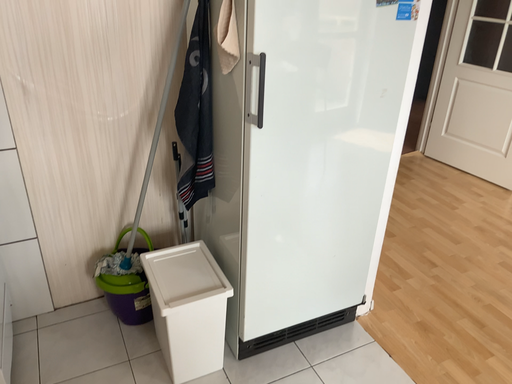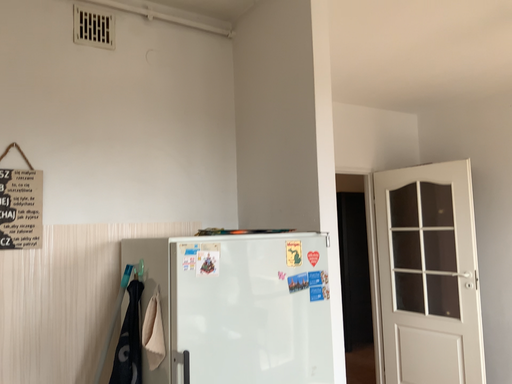
Question: Which way did the camera rotate in the video?

Choices:
 (A) rotated downward
 (B) rotated upward

Answer: (B)